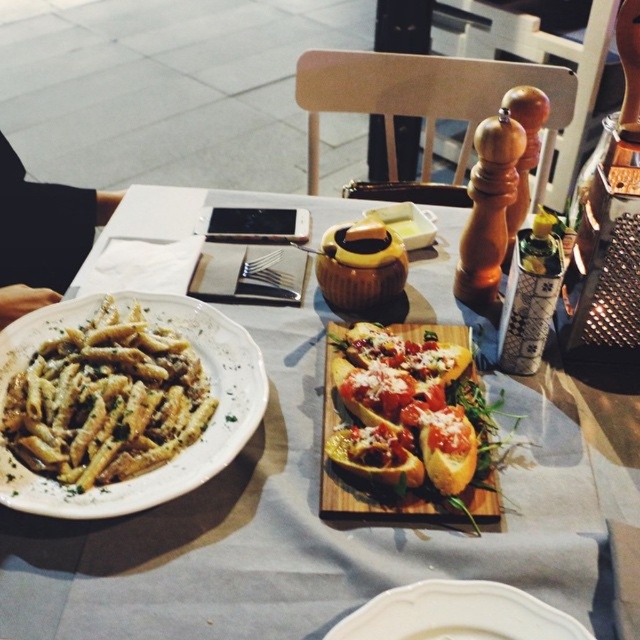
Question: Is black fabric at upper left in front of white ceramic plate at center?

Choices:
 (A) yes
 (B) no

Answer: (B)

Question: Which object is closer to the camera taking this photo?

Choices:
 (A) white ceramic plate at left
 (B) golden brown crusty bread at center

Answer: (A)

Question: Which of the following is the farthest from the observer?

Choices:
 (A) black fabric at upper left
 (B) white ceramic plate at left

Answer: (A)

Question: Which object appears farthest from the camera in this image?

Choices:
 (A) golden brown crusty bread at center
 (B) black fabric at upper left
 (C) white ceramic plate at center
 (D) white matte plate at left

Answer: (B)

Question: Can you confirm if white matte plate at left is positioned to the left of black fabric at upper left?

Choices:
 (A) yes
 (B) no

Answer: (B)

Question: Does white ceramic plate at left appear under black fabric at upper left?

Choices:
 (A) yes
 (B) no

Answer: (A)